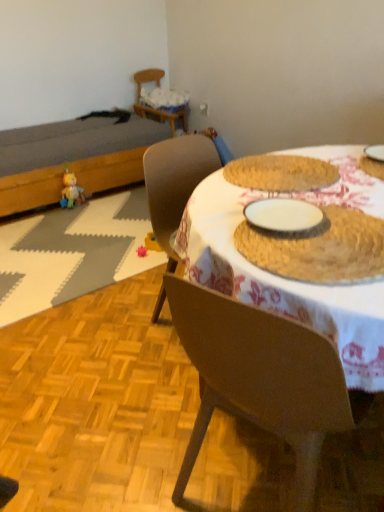
Identify the location of free space in front of plush yellow duck at left, which is the second toy in right-to-left order. The image size is (384, 512). (72, 217).